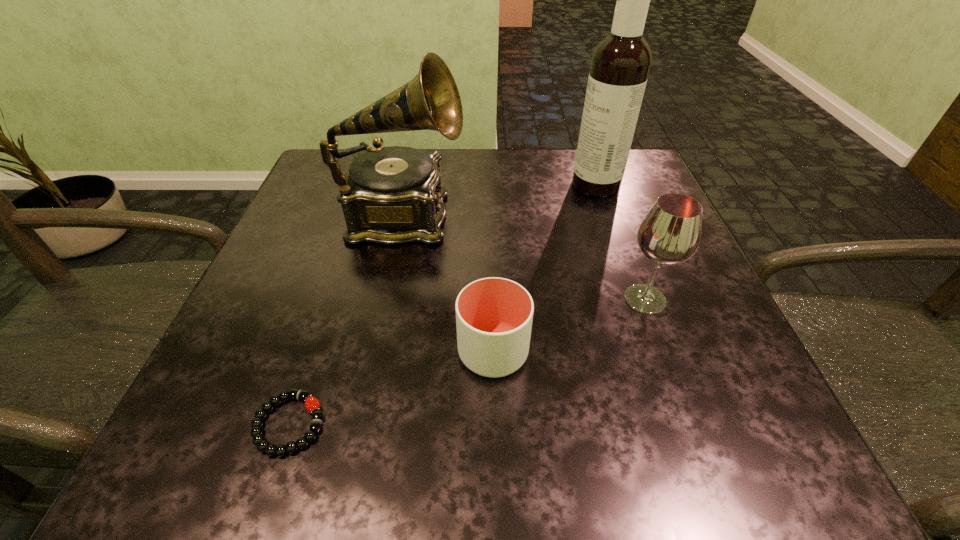
In the image, there is a desktop. Identify the location of blank space at the near right corner. The image size is (960, 540). (x=746, y=470).

Locate an element on the screen. The height and width of the screenshot is (540, 960). empty space that is in between the third shortest object and the dishwasher detergent is located at coordinates (620, 242).

Where is `vacant area that lies between the second shortest object and the wineglass`? The width and height of the screenshot is (960, 540). vacant area that lies between the second shortest object and the wineglass is located at coordinates (569, 326).

The width and height of the screenshot is (960, 540). Find the location of `vacant area that lies between the wineglass and the dishwasher detergent`. vacant area that lies between the wineglass and the dishwasher detergent is located at coordinates (620, 242).

Image resolution: width=960 pixels, height=540 pixels. I want to click on free point between the fourth farthest object and the nearest object, so click(391, 388).

Image resolution: width=960 pixels, height=540 pixels. Find the location of `vacant point located between the wineglass and the dishwasher detergent`. vacant point located between the wineglass and the dishwasher detergent is located at coordinates (620, 242).

Where is `free space between the bracelet and the dishwasher detergent`? The height and width of the screenshot is (540, 960). free space between the bracelet and the dishwasher detergent is located at coordinates (443, 304).

I want to click on vacant area that lies between the third tallest object and the phonograph record, so click(523, 259).

The image size is (960, 540). Identify the location of free space that is in between the cup and the wineglass. (569, 326).

Find the location of a particular element. The width and height of the screenshot is (960, 540). free space between the second shortest object and the bracelet is located at coordinates (391, 388).